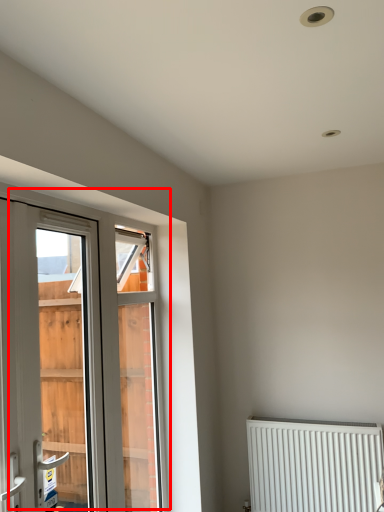
Question: From the image's perspective, considering the relative positions of window (annotated by the red box) and radiator in the image provided, where is window (annotated by the red box) located with respect to the staircase?

Choices:
 (A) above
 (B) below

Answer: (A)